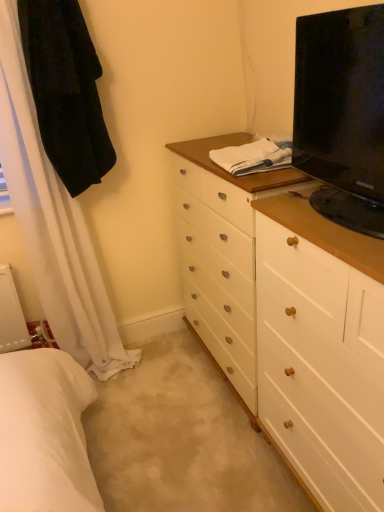
In order to face black fabric robe at upper left, should I rotate leftwards or rightwards?

To face it directly, rotate left by 15.602 degrees.

The image size is (384, 512). What do you see at coordinates (66, 91) in the screenshot?
I see `black fabric robe at upper left` at bounding box center [66, 91].

Measure the distance between point (x=83, y=97) and camera.

A distance of 1.68 meters exists between point (x=83, y=97) and camera.

Where is `black fabric robe at upper left`? This screenshot has width=384, height=512. black fabric robe at upper left is located at coordinates (66, 91).

This screenshot has width=384, height=512. What do you see at coordinates (342, 114) in the screenshot? I see `black glossy tv at upper right` at bounding box center [342, 114].

Find the location of a particular element. This screenshot has height=512, width=384. black glossy tv at upper right is located at coordinates (342, 114).

The height and width of the screenshot is (512, 384). Find the location of `black fabric robe at upper left`. black fabric robe at upper left is located at coordinates (66, 91).

Does black glossy tv at upper right appear on the left side of black fabric robe at upper left?

Incorrect, black glossy tv at upper right is not on the left side of black fabric robe at upper left.

Is black glossy tv at upper right closer to the viewer compared to black fabric robe at upper left?

Yes, black glossy tv at upper right is closer to the camera.

Is point (339, 184) positioned in front of point (97, 149)?

Yes, point (339, 184) is closer to viewer.

From the image's perspective, is black glossy tv at upper right located above black fabric robe at upper left?

Incorrect, from the image's perspective, black glossy tv at upper right is lower than black fabric robe at upper left.

From a real-world perspective, is black glossy tv at upper right over black fabric robe at upper left?

Incorrect, from a real-world perspective, black glossy tv at upper right is lower than black fabric robe at upper left.

In the scene shown: In terms of width, does black glossy tv at upper right look wider or thinner when compared to black fabric robe at upper left?

Considering their sizes, black glossy tv at upper right looks broader than black fabric robe at upper left.

Does black glossy tv at upper right have a lesser height compared to black fabric robe at upper left?

Yes.

Based on their sizes in the image, would you say black glossy tv at upper right is bigger or smaller than black fabric robe at upper left?

In the image, black glossy tv at upper right appears to be larger than black fabric robe at upper left.

Is black glossy tv at upper right inside or outside of black fabric robe at upper left?

The correct answer is: outside.

Is there a large distance between black glossy tv at upper right and black fabric robe at upper left?

That's not correct — black glossy tv at upper right is a little close to black fabric robe at upper left.

Is black glossy tv at upper right aimed at black fabric robe at upper left?

No, black glossy tv at upper right is not facing towards black fabric robe at upper left.

I want to click on television below the black fabric robe at upper left (from a real-world perspective), so click(342, 114).

In the image, is black fabric robe at upper left on the left side or the right side of black glossy tv at upper right?

Based on their positions, black fabric robe at upper left is located to the left of black glossy tv at upper right.

Which is behind, black fabric robe at upper left or black glossy tv at upper right?

black fabric robe at upper left is more distant.

Does point (57, 142) come farther from viewer compared to point (304, 141)?

Yes, point (57, 142) is behind point (304, 141).

From the image's perspective, relative to black glossy tv at upper right, is black fabric robe at upper left above or below?

black fabric robe at upper left is situated higher than black glossy tv at upper right in the image.

From a real-world perspective, is black fabric robe at upper left positioned above or below black glossy tv at upper right?

From a real-world perspective, black fabric robe at upper left is physically above black glossy tv at upper right.

Which object is wider, black fabric robe at upper left or black glossy tv at upper right?

black glossy tv at upper right.

Between black fabric robe at upper left and black glossy tv at upper right, which one has more height?

With more height is black fabric robe at upper left.

Considering the relative sizes of black fabric robe at upper left and black glossy tv at upper right in the image provided, is black fabric robe at upper left smaller than black glossy tv at upper right?

Yes.

Would you say black fabric robe at upper left is inside or outside black glossy tv at upper right?

black fabric robe at upper left exists outside the volume of black glossy tv at upper right.

Is black fabric robe at upper left far from black glossy tv at upper right?

No.

Is black fabric robe at upper left looking in the opposite direction of black glossy tv at upper right?

No, black fabric robe at upper left is not facing the opposite direction of black glossy tv at upper right.

How different are the orientations of black fabric robe at upper left and black glossy tv at upper right in degrees?

black fabric robe at upper left and black glossy tv at upper right are facing 92.9 degrees away from each other.

Locate an element on the screen. The height and width of the screenshot is (512, 384). television that is under the black fabric robe at upper left (from a real-world perspective) is located at coordinates (342, 114).

The height and width of the screenshot is (512, 384). What are the coordinates of `robe above the black glossy tv at upper right (from the image's perspective)` in the screenshot? It's located at (66, 91).

Identify the location of television lying in front of the black fabric robe at upper left. This screenshot has width=384, height=512. (342, 114).